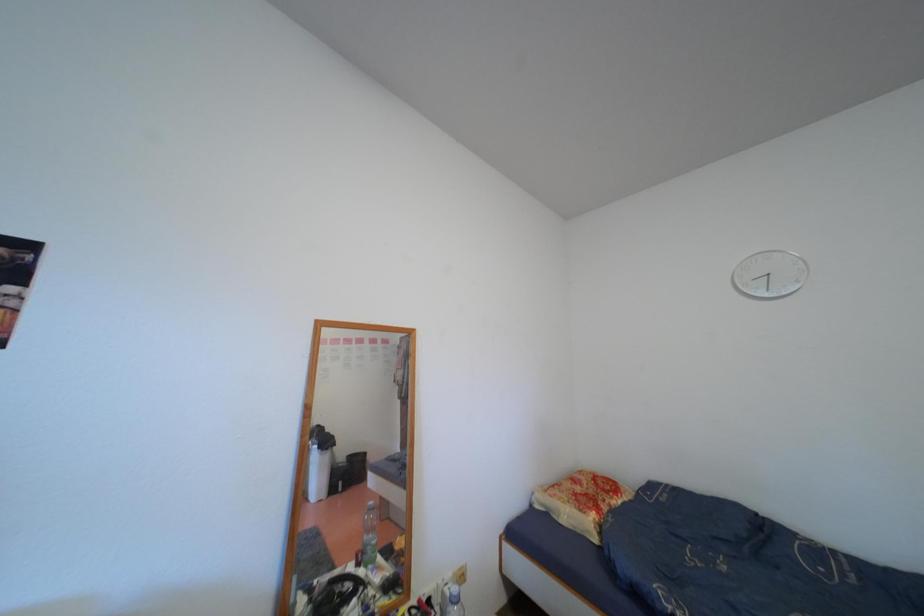
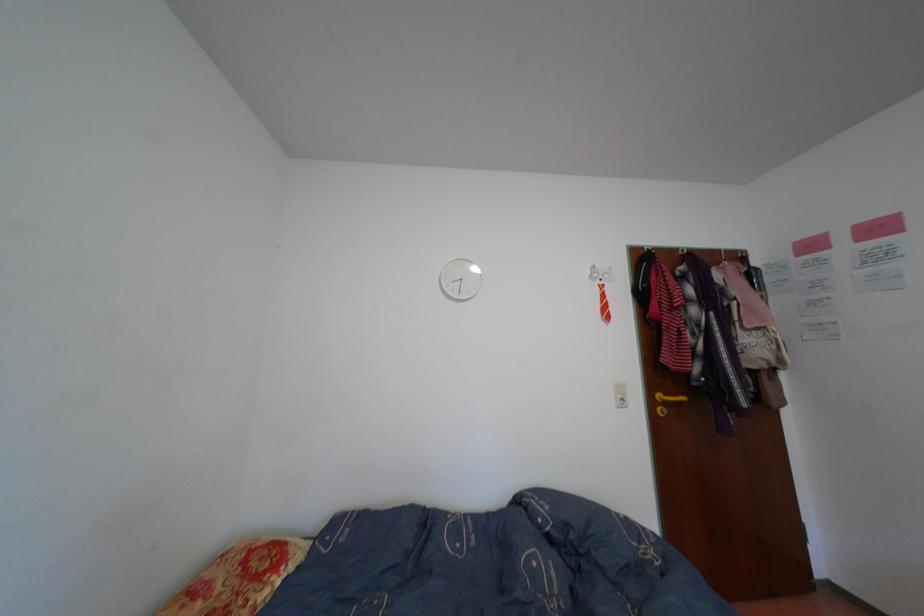
Question: The first image is from the beginning of the video and the second image is from the end. How did the camera likely rotate when shooting the video?

Choices:
 (A) Left
 (B) Right
 (C) Up
 (D) Down

Answer: (B)